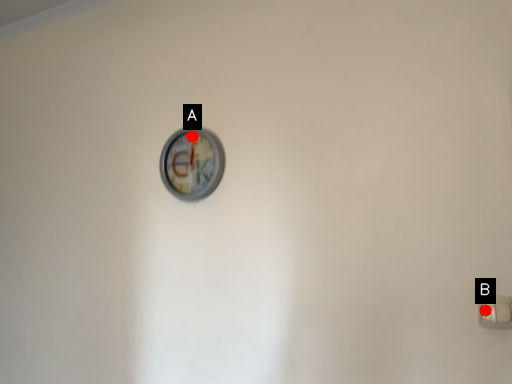
Question: Two points are circled on the image, labeled by A and B beside each circle. Which point is farther from the camera taking this photo?

Choices:
 (A) A is further
 (B) B is further

Answer: (A)